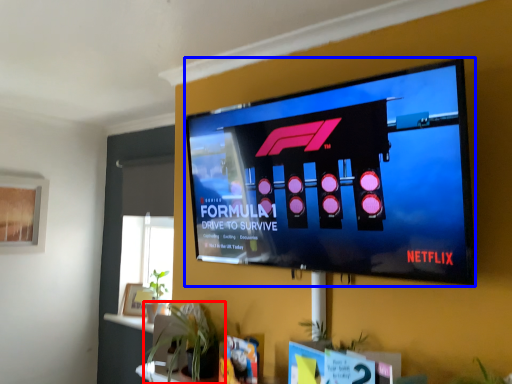
Question: Which of the following is the farthest to the observer, houseplant (highlighted by a red box) or television (highlighted by a blue box)?

Choices:
 (A) houseplant
 (B) television

Answer: (A)